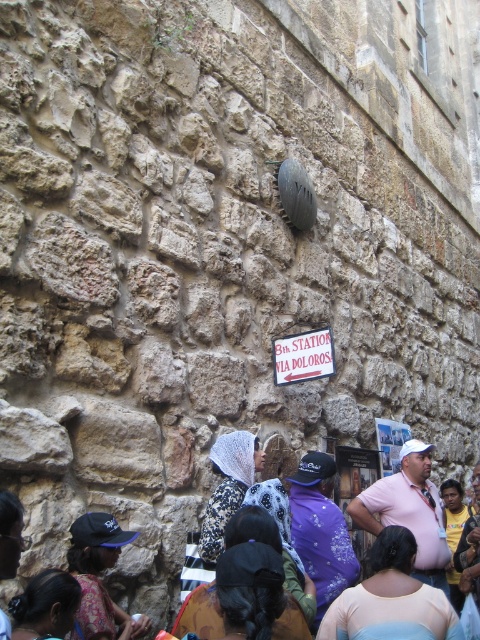
Question: Which point is farther to the camera?

Choices:
 (A) printed fabric headscarf at center
 (B) matte black cap at lower left
 (C) dark brown hair at lower left

Answer: (A)

Question: Which object is the closest to the light blue fabric at center?

Choices:
 (A) white paper sign at center
 (B) black fabric headscarf at center
 (C) dark brown hair at lower left

Answer: (B)

Question: Is printed fabric headscarf at center bigger than dark brown hair at lower left?

Choices:
 (A) yes
 (B) no

Answer: (A)

Question: Does black fabric headscarf at center appear under purple fabric at center?

Choices:
 (A) yes
 (B) no

Answer: (A)

Question: From the image, what is the correct spatial relationship of purple fabric at center in relation to dark brown hair at lower left?

Choices:
 (A) below
 (B) above

Answer: (B)

Question: Which object appears closest to the camera in this image?

Choices:
 (A) light blue fabric at center
 (B) black fabric headscarf at center
 (C) white paper sign at center

Answer: (B)